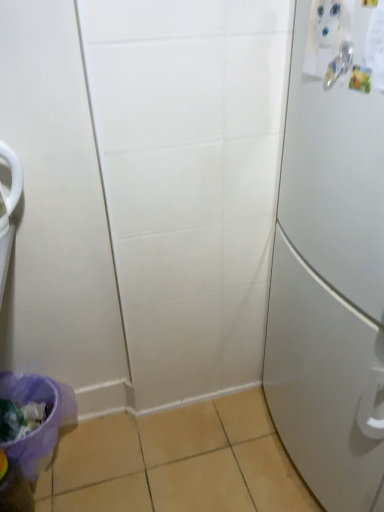
Question: Is silver metallic door handle at upper right turned away from translucent plastic bottle at lower left?

Choices:
 (A) yes
 (B) no

Answer: (B)

Question: Can you confirm if silver metallic door handle at upper right is taller than translucent plastic bottle at lower left?

Choices:
 (A) no
 (B) yes

Answer: (A)

Question: From a real-world perspective, is silver metallic door handle at upper right on top of translucent plastic bottle at lower left?

Choices:
 (A) no
 (B) yes

Answer: (B)

Question: Is silver metallic door handle at upper right outside of translucent plastic bottle at lower left?

Choices:
 (A) yes
 (B) no

Answer: (A)

Question: From the image's perspective, is silver metallic door handle at upper right on top of translucent plastic bottle at lower left?

Choices:
 (A) no
 (B) yes

Answer: (B)

Question: In the image, is white matte refrigerator at right on the left side or the right side of silver metallic door handle at upper right?

Choices:
 (A) right
 (B) left

Answer: (A)

Question: From the image's perspective, is white matte refrigerator at right positioned above or below silver metallic door handle at upper right?

Choices:
 (A) below
 (B) above

Answer: (A)

Question: Based on their sizes in the image, would you say white matte refrigerator at right is bigger or smaller than silver metallic door handle at upper right?

Choices:
 (A) big
 (B) small

Answer: (A)

Question: From their relative heights in the image, would you say white matte refrigerator at right is taller or shorter than silver metallic door handle at upper right?

Choices:
 (A) short
 (B) tall

Answer: (B)

Question: In terms of height, does silver metallic door handle at upper right look taller or shorter compared to white matte refrigerator at right?

Choices:
 (A) tall
 (B) short

Answer: (B)

Question: Is silver metallic door handle at upper right bigger or smaller than white matte refrigerator at right?

Choices:
 (A) big
 (B) small

Answer: (B)

Question: From a real-world perspective, is silver metallic door handle at upper right physically located above or below white matte refrigerator at right?

Choices:
 (A) above
 (B) below

Answer: (A)

Question: In the image, is silver metallic door handle at upper right on the left side or the right side of white matte refrigerator at right?

Choices:
 (A) left
 (B) right

Answer: (A)

Question: Looking at their shapes, would you say purple fabric potty at lower left is wider or thinner than white matte refrigerator at right?

Choices:
 (A) thin
 (B) wide

Answer: (A)

Question: From the image's perspective, is purple fabric potty at lower left positioned above or below white matte refrigerator at right?

Choices:
 (A) above
 (B) below

Answer: (B)